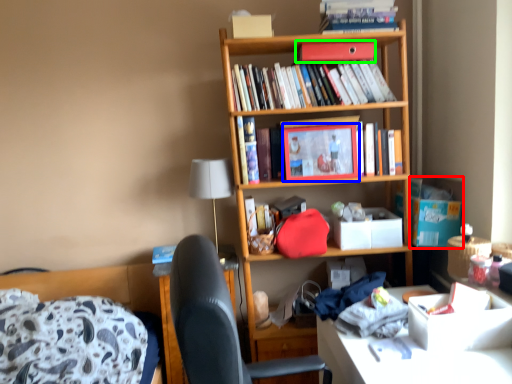
Question: Estimate the real-world distances between objects in this image. Which object is closer to cardboard box (highlighted by a red box), picture frame (highlighted by a blue box) or paperback book (highlighted by a green box)?

Choices:
 (A) picture frame
 (B) paperback book

Answer: (A)